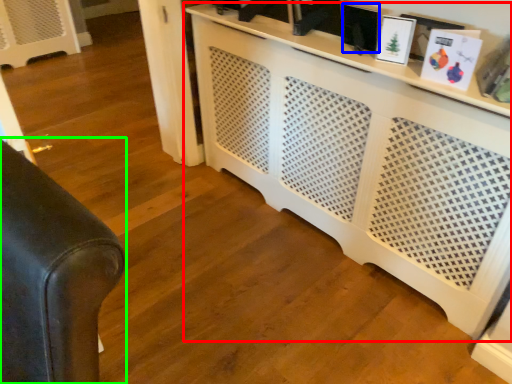
Question: Considering the real-world distances, which object is closest to entertainment center (highlighted by a red box)? picture frame (highlighted by a blue box) or furniture (highlighted by a green box).

Choices:
 (A) picture frame
 (B) furniture

Answer: (A)